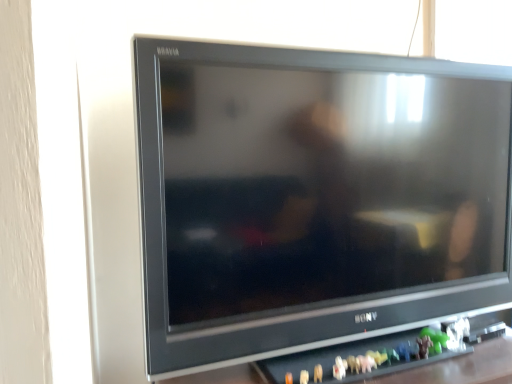
This screenshot has height=384, width=512. Describe the element at coordinates (314, 197) in the screenshot. I see `satin black television at center` at that location.

Measure the distance between point [284,143] and camera.

Point [284,143] is 34.65 inches from camera.

Find the location of a particular element. Image resolution: width=512 pixels, height=384 pixels. satin black television at center is located at coordinates (314, 197).

This screenshot has height=384, width=512. In order to click on satin black television at center in this screenshot , I will do `click(314, 197)`.